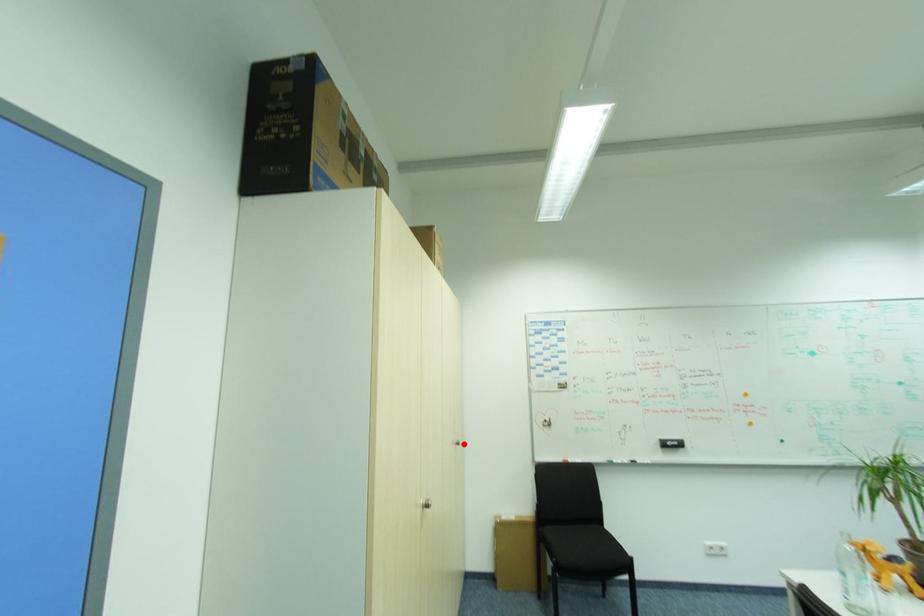
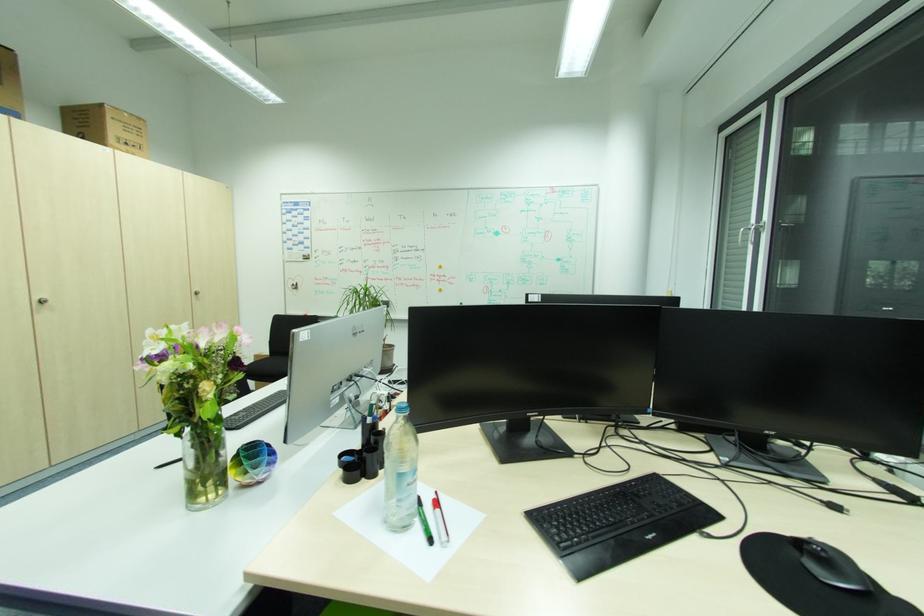
Find the pixel in the second image that matches the highlighted location in the first image.

(202, 293)